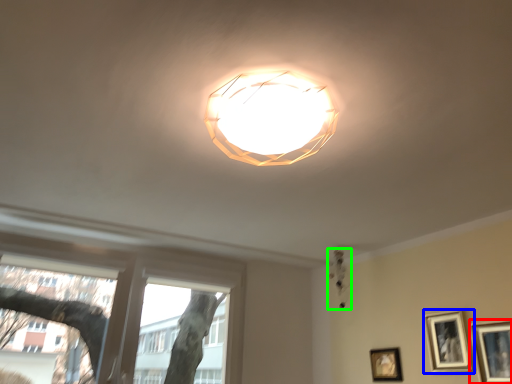
Question: Which is nearer to the picture frame (highlighted by a red box)? picture frame (highlighted by a blue box) or lamp (highlighted by a green box).

Choices:
 (A) picture frame
 (B) lamp

Answer: (A)